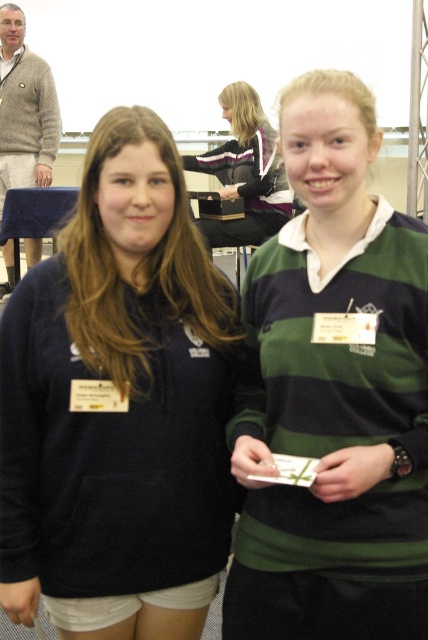
Question: Which of these objects is positioned farthest from the matte black jacket at center?

Choices:
 (A) green striped sweater at center
 (B) dark blue fleece at center
 (C) knitted gray sweater at upper left

Answer: (A)

Question: Does dark blue fleece at center have a greater width compared to knitted gray sweater at upper left?

Choices:
 (A) yes
 (B) no

Answer: (A)

Question: Among these objects, which one is farthest from the camera?

Choices:
 (A) dark blue fleece at center
 (B) matte black jacket at center
 (C) knitted gray sweater at upper left

Answer: (C)

Question: Is dark blue fleece at center further to the viewer compared to matte black jacket at center?

Choices:
 (A) no
 (B) yes

Answer: (A)

Question: Which point is closer to the camera?

Choices:
 (A) (158, 620)
 (B) (12, 10)
 (C) (265, 180)
 (D) (324, 419)

Answer: (D)

Question: Is dark blue fleece at center positioned behind knitted gray sweater at upper left?

Choices:
 (A) yes
 (B) no

Answer: (B)